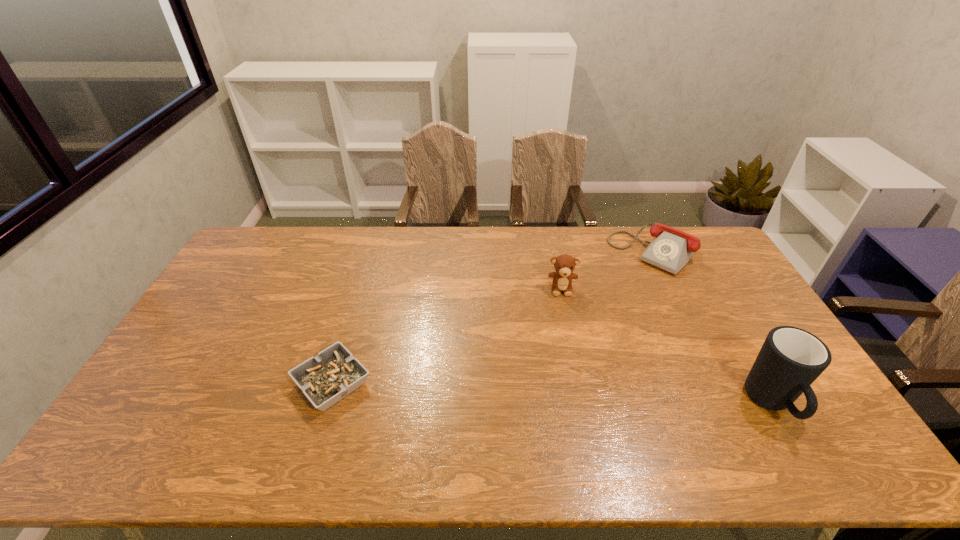
Where is `object located in the near right corner section of the desktop`? The width and height of the screenshot is (960, 540). object located in the near right corner section of the desktop is located at coordinates (791, 359).

You are a GUI agent. You are given a task and a screenshot of the screen. Output one action in this format:
    pyautogui.click(x=<x>, y=<y>)
    Task: Click on the blank area at the far edge
    The width and height of the screenshot is (960, 540).
    Given the screenshot: What is the action you would take?
    pyautogui.click(x=399, y=249)

You are a GUI agent. You are given a task and a screenshot of the screen. Output one action in this format:
    pyautogui.click(x=<x>, y=<y>)
    Task: Click on the blank space at the near edge
    The width and height of the screenshot is (960, 540).
    Given the screenshot: What is the action you would take?
    pyautogui.click(x=590, y=415)

You are a GUI agent. You are given a task and a screenshot of the screen. Output one action in this format:
    pyautogui.click(x=<x>, y=<y>)
    Task: Click on the free region at the left edge of the desktop
    This screenshot has width=960, height=540.
    Given the screenshot: What is the action you would take?
    pyautogui.click(x=264, y=281)

The image size is (960, 540). In the image, there is a desktop. Find the location of `vacant space at the right edge`. vacant space at the right edge is located at coordinates (719, 316).

The height and width of the screenshot is (540, 960). Find the location of `blank space at the far left corner of the desktop`. blank space at the far left corner of the desktop is located at coordinates (242, 265).

Where is `free spot between the farthest object and the mug`? free spot between the farthest object and the mug is located at coordinates (712, 328).

In order to click on empty space between the leftmost object and the second tallest object in this screenshot , I will do click(447, 336).

Locate an element on the screen. Image resolution: width=960 pixels, height=540 pixels. free space between the ashtray and the farthest object is located at coordinates (492, 318).

You are a GUI agent. You are given a task and a screenshot of the screen. Output one action in this format:
    pyautogui.click(x=<x>, y=<y>)
    Task: Click on the vacant point located between the ashtray and the second shortest object
    This screenshot has width=960, height=540.
    Given the screenshot: What is the action you would take?
    pyautogui.click(x=492, y=318)